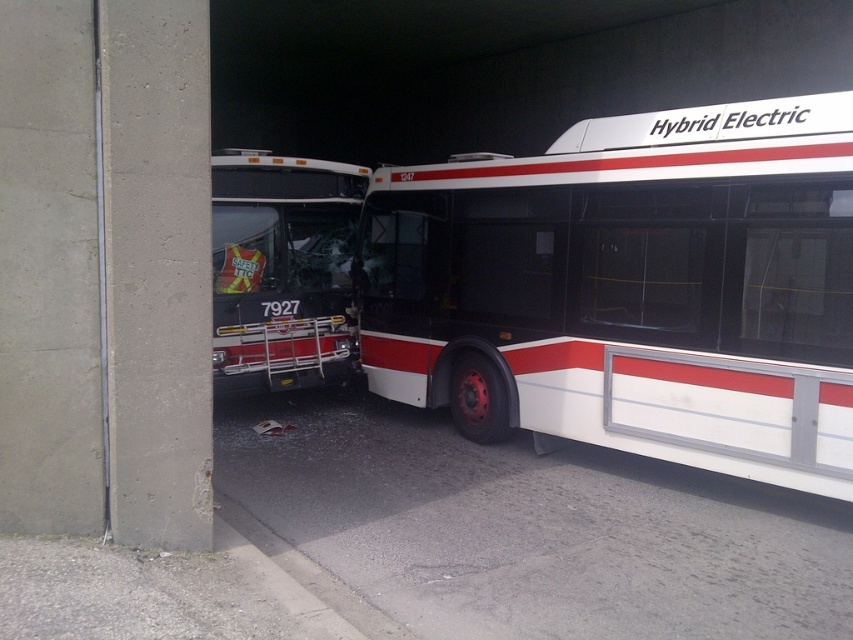
You are standing at the entrance of the garage and want to locate the white glossy hybrid electric bus at center. According to the coordinates provided, where should you look relative to the entrance?

The white glossy hybrid electric bus at center is located at coordinates point (631,289), which means it is positioned towards the right side and slightly forward from the entrance of the garage.

You are a mechanic working in the garage and need to access the engine compartment of the white glossy hybrid electric bus at center. The engine is located at the front of the bus. Given that the matte black bus at left is blocking part of the garage entrance, can you safely open the engine compartment door?

The white glossy hybrid electric bus at center is positioned under the matte black bus at left, so opening the engine compartment door might be restricted due to the positioning. Check the space above before opening to avoid collision.